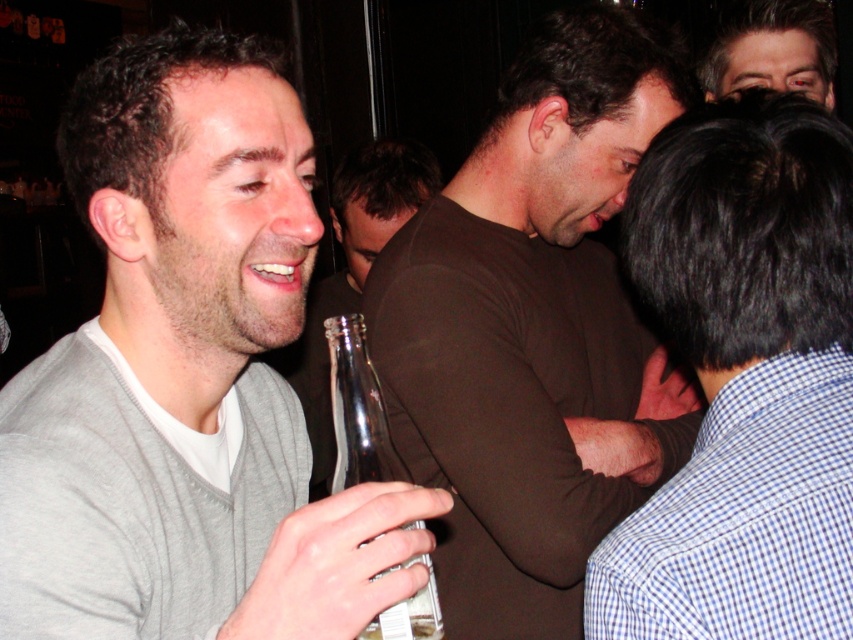
Can you confirm if brown matte shirt at center is bigger than matte gray sweater at left?

Incorrect, brown matte shirt at center is not larger than matte gray sweater at left.

Does brown matte shirt at center lie in front of matte gray sweater at left?

Yes, brown matte shirt at center is in front of matte gray sweater at left.

Is point (582, 156) farther from viewer compared to point (334, 291)?

No, it is in front of (334, 291).

Find the location of a particular element. The image size is (853, 640). brown matte shirt at center is located at coordinates (529, 324).

Describe the element at coordinates (187, 378) in the screenshot. I see `gray sweater at center` at that location.

What are the coordinates of `gray sweater at center` in the screenshot? It's located at (187, 378).

At what (x,y) coordinates should I click in order to perform the action: click on gray sweater at center. Please return your answer as a coordinate pair (x, y). Looking at the image, I should click on (187, 378).

Is matte gray sweater at left thinner than clear glass bottle at lower left?

Incorrect, matte gray sweater at left's width is not less than clear glass bottle at lower left's.

Which is above, matte gray sweater at left or clear glass bottle at lower left?

matte gray sweater at left

Locate an element on the screen. matte gray sweater at left is located at coordinates (352, 272).